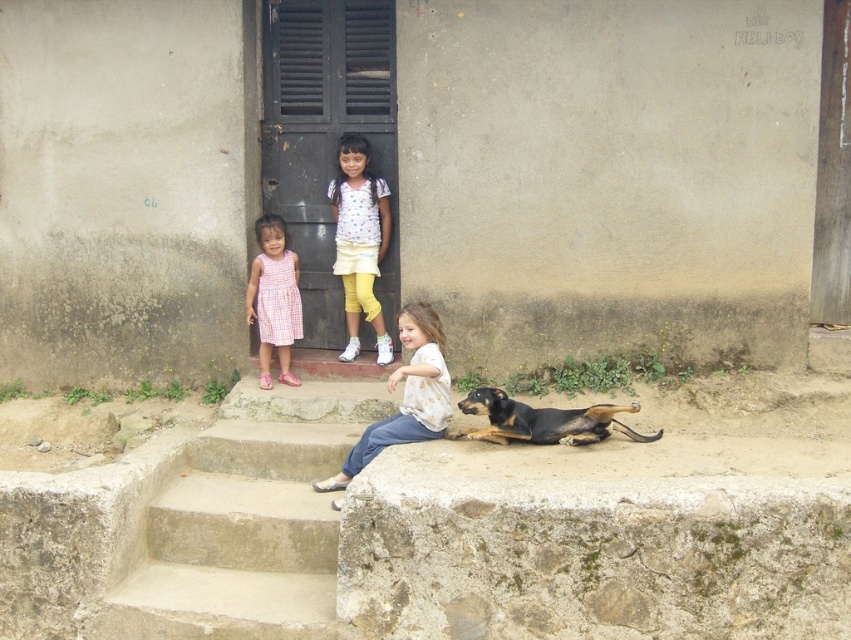
You are standing on the concrete stairs at lower center and want to move to the pink checkered dress at left. Considering the width of the path between them, can you walk straight to the dress without needing to step aside?

The concrete stairs at lower center is wider than the pink checkered dress at left, so yes, you can walk straight to the dress without needing to step aside since the stairs provide enough width.

You are a delivery person trying to reach the door. You see the concrete stairs at lower center and the white cotton shirt at center in your way. Which object is taller and might block your path?

The concrete stairs at lower center is taller than the white cotton shirt at center, so the concrete stairs at lower center might block your path.